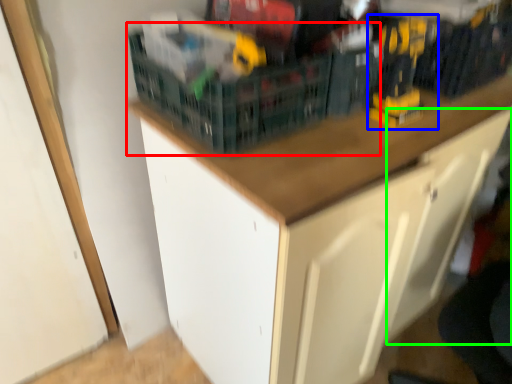
Question: Which object is positioned closest to basket (highlighted by a red box)? Select from toy (highlighted by a blue box) and drawer (highlighted by a green box).

Choices:
 (A) toy
 (B) drawer

Answer: (A)